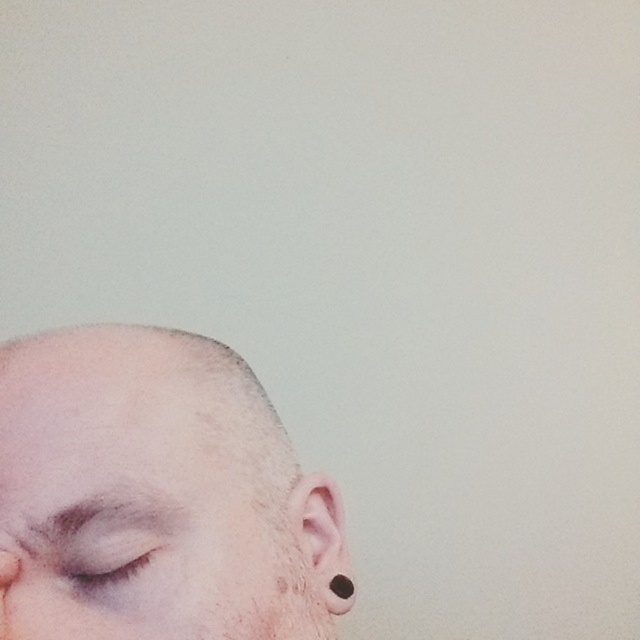
Question: Does smooth skin head at lower left lie behind pink matte ear at lower right?

Choices:
 (A) no
 (B) yes

Answer: (A)

Question: Can you confirm if smooth skin head at lower left is positioned to the right of black matte earring at lower left?

Choices:
 (A) yes
 (B) no

Answer: (B)

Question: Which point appears farthest from the camera in this image?

Choices:
 (A) (58, 564)
 (B) (244, 512)

Answer: (B)

Question: Among these points, which one is nearest to the camera?

Choices:
 (A) (310, 554)
 (B) (352, 579)
 (C) (100, 577)
 (D) (8, 632)

Answer: (D)

Question: Can you confirm if pink matte ear at lower right is positioned below matte skin eye at lower left?

Choices:
 (A) yes
 (B) no

Answer: (A)

Question: Which is nearer to the pink matte ear at lower right?

Choices:
 (A) smooth skin head at lower left
 (B) black matte earring at lower left

Answer: (B)